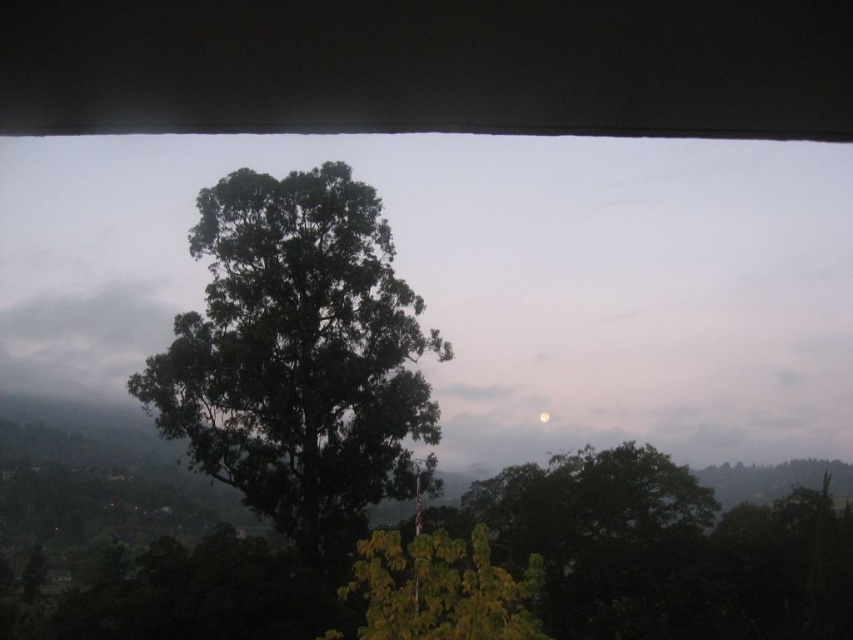
Is green leafy tree at lower center thinner than gray fluffy cloud at upper left?

Indeed, green leafy tree at lower center has a lesser width compared to gray fluffy cloud at upper left.

Between green leafy tree at lower center and gray fluffy cloud at upper left, which one has more height?

With more height is gray fluffy cloud at upper left.

At what (x,y) coordinates should I click in order to perform the action: click on green leafy tree at lower center. Please return your answer as a coordinate pair (x, y). The height and width of the screenshot is (640, 853). Looking at the image, I should click on (440, 588).

Is green leafy tree at center behind green leafy tree at lower center?

Yes, it is behind green leafy tree at lower center.

Is point (360, 218) positioned after point (450, 600)?

Yes, point (360, 218) is behind point (450, 600).

Is point (146, 392) farther from viewer compared to point (508, 637)?

That is True.

Locate an element on the screen. This screenshot has height=640, width=853. green leafy tree at center is located at coordinates (299, 356).

Who is more distant from viewer, (189,436) or (540,417)?

Positioned behind is point (540,417).

Is green leafy tree at center taller than bright silver moon at center?

Yes, green leafy tree at center is taller than bright silver moon at center.

Is point (270, 387) positioned in front of point (543, 417)?

Yes, it is in front of point (543, 417).

This screenshot has width=853, height=640. Identify the location of green leafy tree at center. (299, 356).